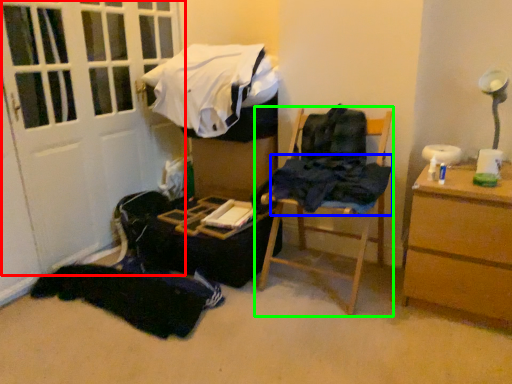
Question: Which is farther away from door (highlighted by a red box)? clothing (highlighted by a blue box) or furniture (highlighted by a green box)?

Choices:
 (A) clothing
 (B) furniture

Answer: (A)